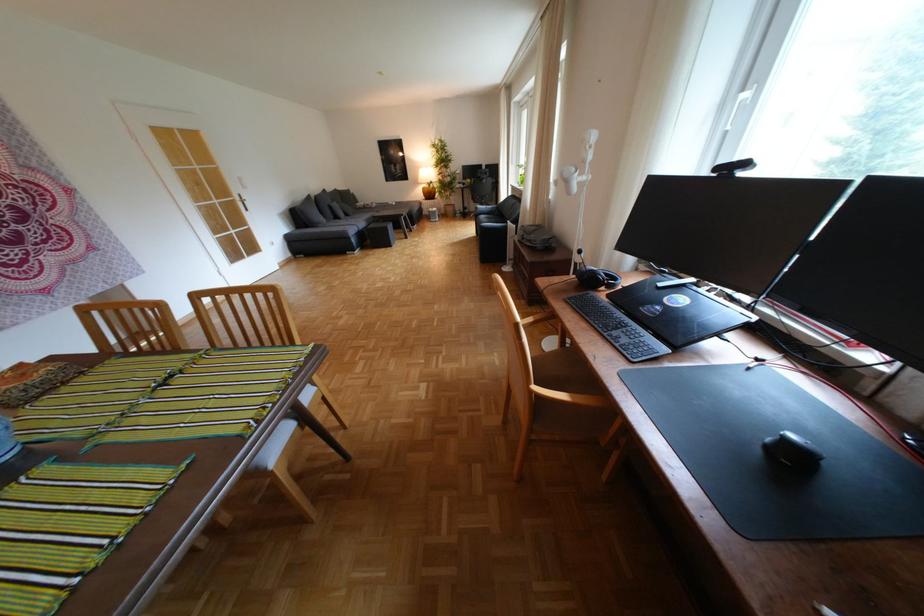
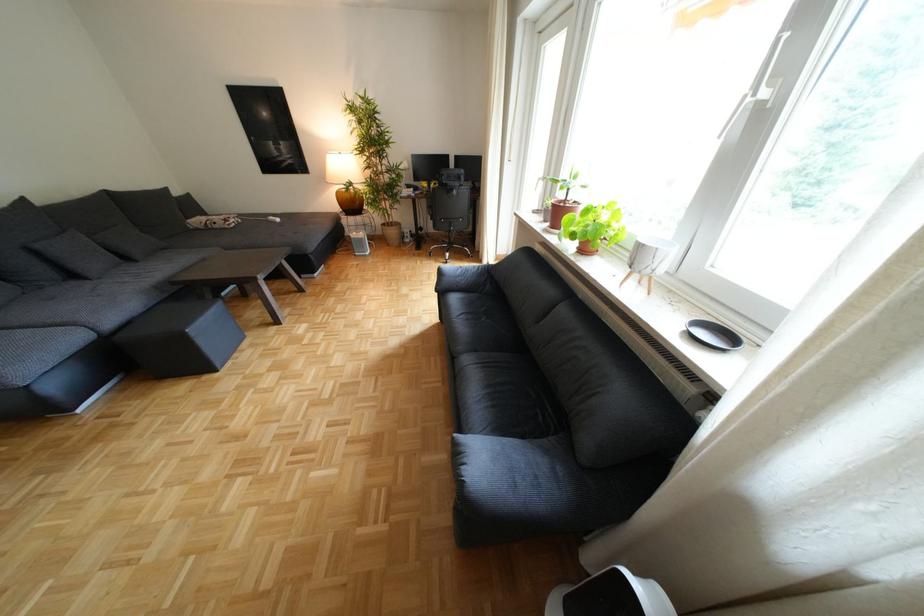
Question: In a continuous first-person perspective shot, in which direction is the camera moving?

Choices:
 (A) Left
 (B) Right
 (C) Forward
 (D) Backward

Answer: (C)